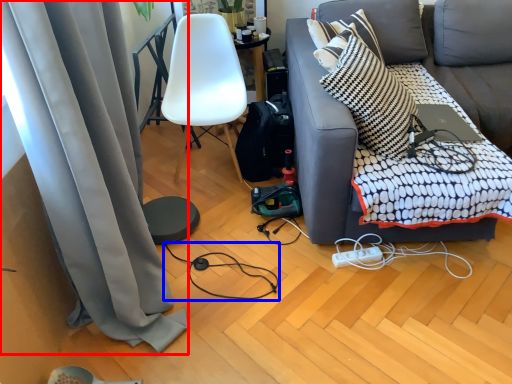
Question: Which of the following is the farthest to the observer, curtain (highlighted by a red box) or wire (highlighted by a blue box)?

Choices:
 (A) curtain
 (B) wire

Answer: (B)